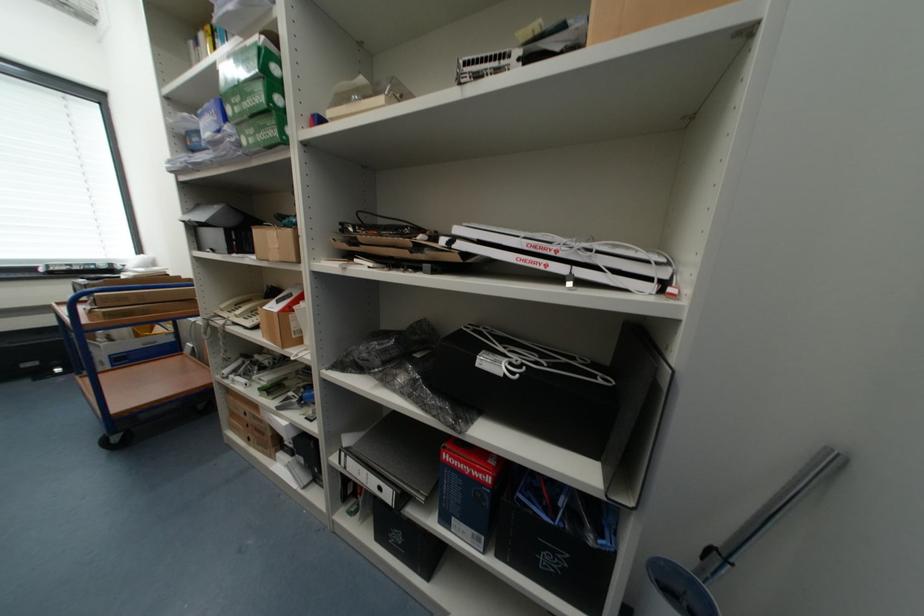
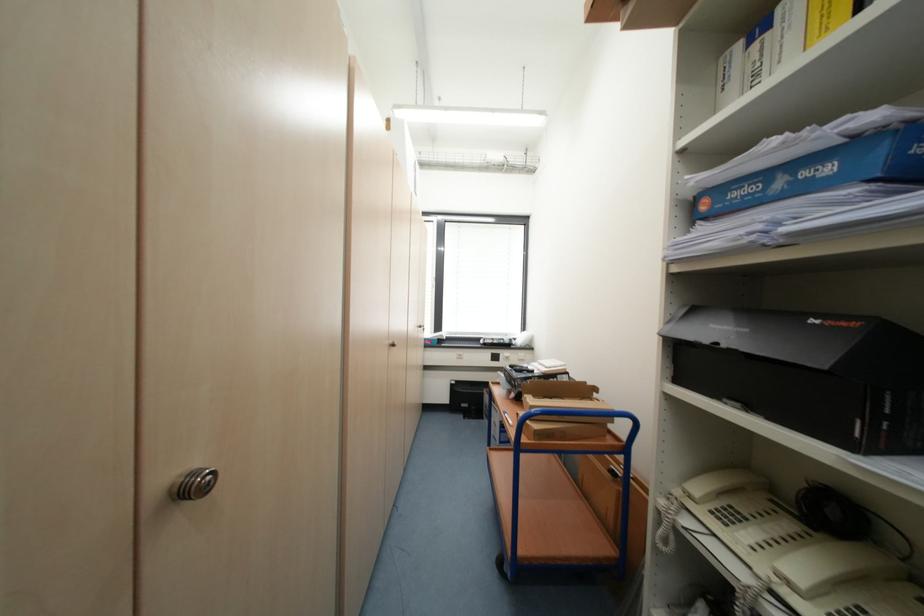
Find the pixel in the second image that matches [116,315] in the first image.

(544, 436)